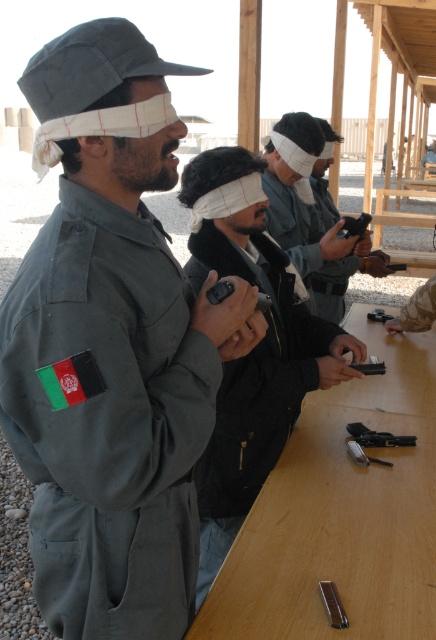
Which of these two, matte gray uniform at center or wooden table at center, stands shorter?

Standing shorter between the two is wooden table at center.

The image size is (436, 640). What do you see at coordinates (112, 346) in the screenshot?
I see `matte gray uniform at center` at bounding box center [112, 346].

Where is `matte gray uniform at center`? This screenshot has height=640, width=436. matte gray uniform at center is located at coordinates (112, 346).

Who is positioned more to the left, matte black gun at center or matte black pistol at center?

matte black gun at center is more to the left.

Does matte black gun at center appear over matte black pistol at center?

No.

The width and height of the screenshot is (436, 640). What do you see at coordinates (299, 196) in the screenshot?
I see `matte black gun at center` at bounding box center [299, 196].

At what (x,y) coordinates should I click in order to perform the action: click on matte black gun at center. Please return your answer as a coordinate pair (x, y). Image resolution: width=436 pixels, height=640 pixels. Looking at the image, I should click on (299, 196).

Is point (115, 451) behind point (299, 124)?

No, it is not.

Can you confirm if matte gray uniform at center is wider than matte black gun at center?

Yes.

Is point (74, 36) more distant than point (331, 232)?

That is False.

The image size is (436, 640). In order to click on matte gray uniform at center in this screenshot , I will do `click(112, 346)`.